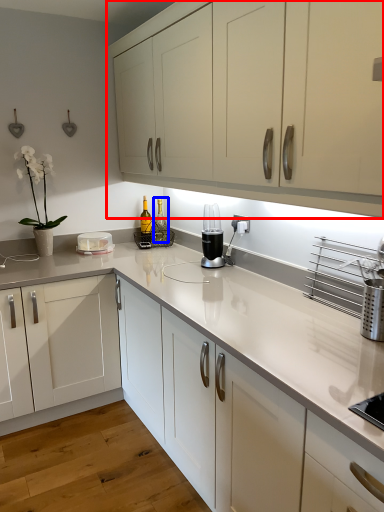
Question: Which point is closer to the camera, cabinetry (highlighted by a red box) or bottle (highlighted by a blue box)?

Choices:
 (A) cabinetry
 (B) bottle

Answer: (A)